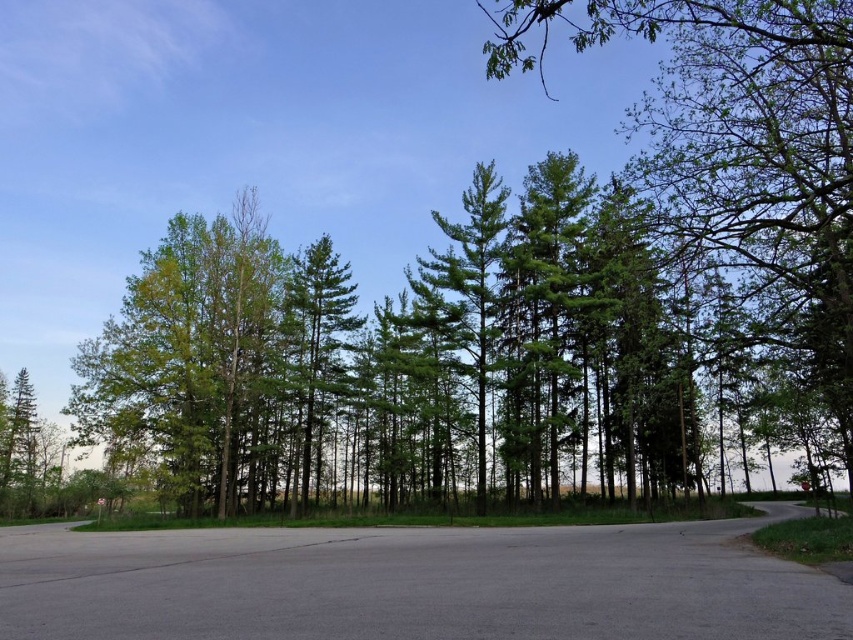
Question: Where is green matte tree at upper right located in relation to green pine tree at center in the image?

Choices:
 (A) above
 (B) below

Answer: (A)

Question: Among these objects, which one is nearest to the camera?

Choices:
 (A) green pine tree at center
 (B) green matte tree at upper right

Answer: (B)

Question: Is green matte tree at upper right further to camera compared to green pine tree at center?

Choices:
 (A) yes
 (B) no

Answer: (B)

Question: Does green matte tree at upper right come behind green pine tree at center?

Choices:
 (A) no
 (B) yes

Answer: (A)